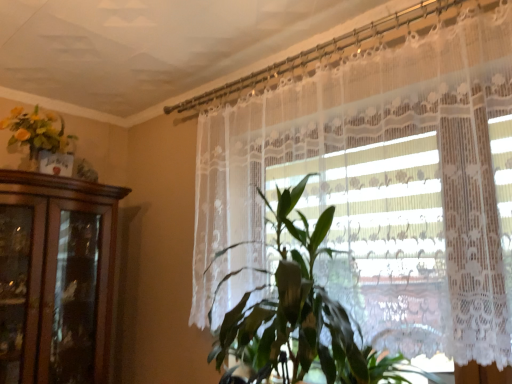
Question: Considering the positions of point (264, 352) and point (61, 168), is point (264, 352) closer or farther from the camera than point (61, 168)?

Choices:
 (A) closer
 (B) farther

Answer: (A)

Question: From a real-world perspective, is green leafy plant at center positioned above or below matte yellow flowers at upper left?

Choices:
 (A) above
 (B) below

Answer: (B)

Question: Estimate the real-world distances between objects in this image. Which object is farther from the white lace curtain at center?

Choices:
 (A) green leafy plant at center
 (B) matte yellow flowers at upper left

Answer: (B)

Question: Which is nearer to the green leafy plant at center?

Choices:
 (A) white lace curtain at center
 (B) matte yellow flowers at upper left

Answer: (A)